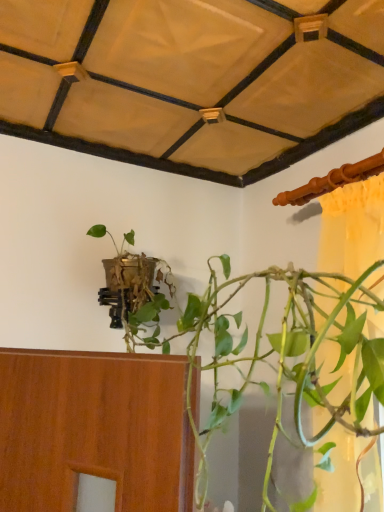
Question: Should I look upward or downward to see green matte plant at center?

Choices:
 (A) up
 (B) down

Answer: (B)